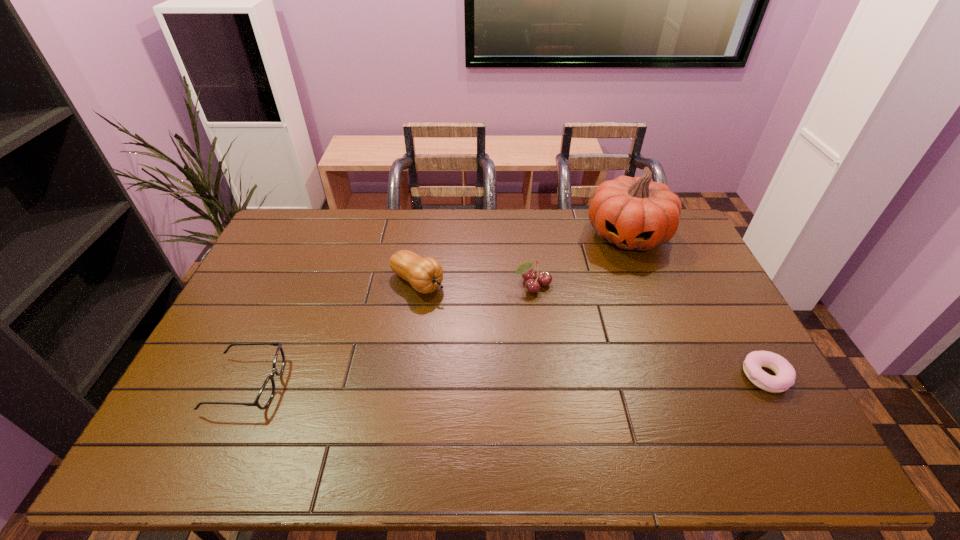
In order to click on vacant spot on the desktop that is between the leftmost object and the doughnut and is positioned on the leaves of the third object from right to left in this screenshot , I will do `click(568, 379)`.

This screenshot has width=960, height=540. In order to click on free spot on the desktop that is between the fourth tallest object and the doughnut and is positioned on the face of the pumpkin in this screenshot , I will do `click(583, 379)`.

Where is `vacant spot on the desktop that is between the leftmost object and the shortest object and is positioned on the stem side of the gourd`? vacant spot on the desktop that is between the leftmost object and the shortest object and is positioned on the stem side of the gourd is located at coordinates (562, 379).